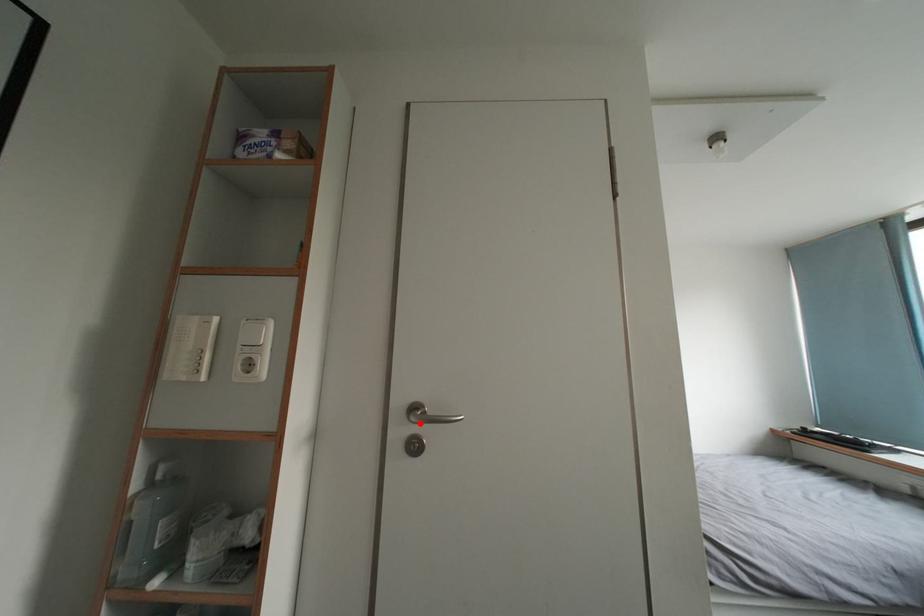
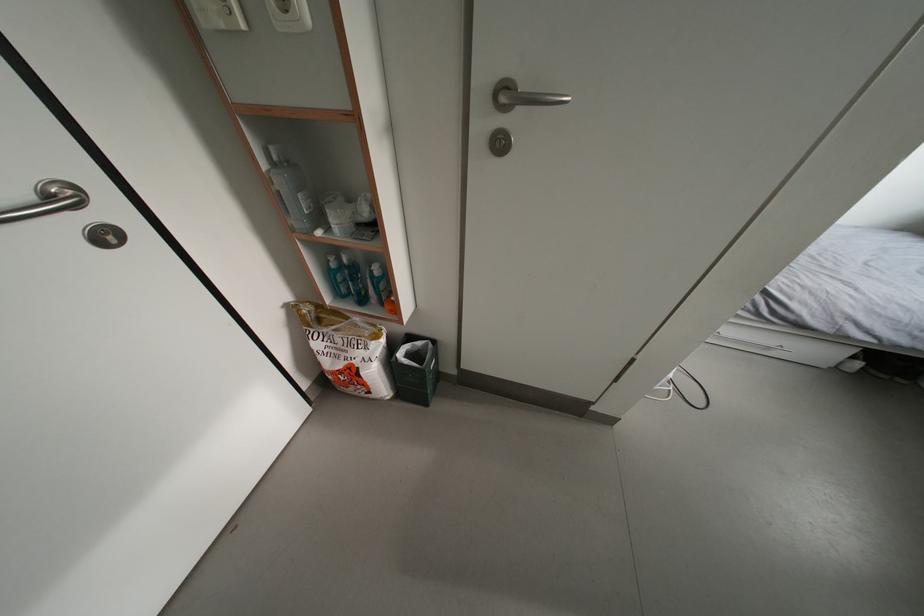
The point at the highlighted location is marked in the first image. Where is the corresponding point in the second image?

(509, 105)